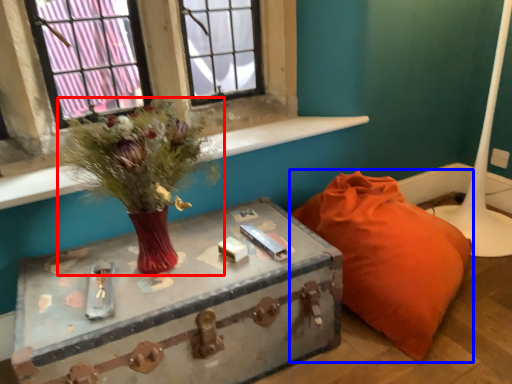
Question: Which of the following is the closest to the observer, floral arrangement (highlighted by a red box) or furniture (highlighted by a blue box)?

Choices:
 (A) floral arrangement
 (B) furniture

Answer: (A)